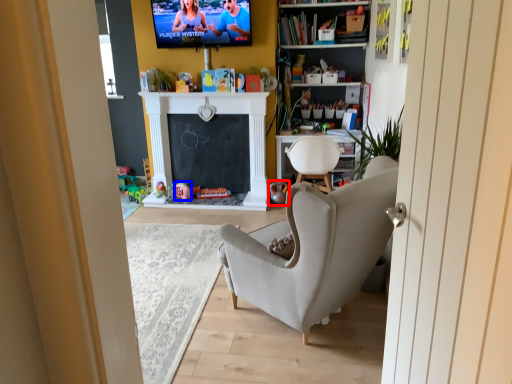
Question: Which of the following is the farthest to the observer, toy (highlighted by a red box) or toy (highlighted by a blue box)?

Choices:
 (A) toy
 (B) toy

Answer: (B)